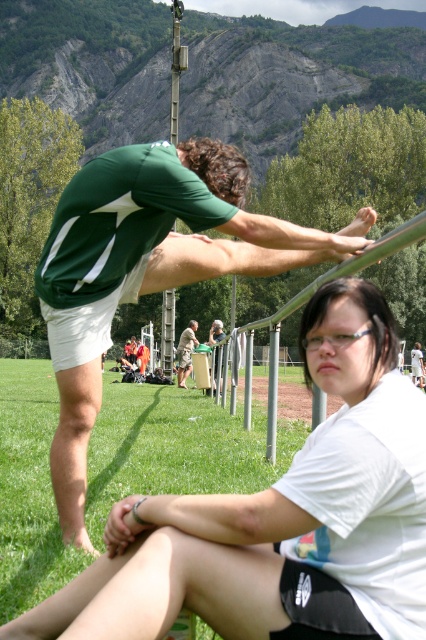
Please provide the 2D coordinates of the green fabric shirt at upper left in the image.

The 2D coordinates of the green fabric shirt at upper left are at point (167, 227).